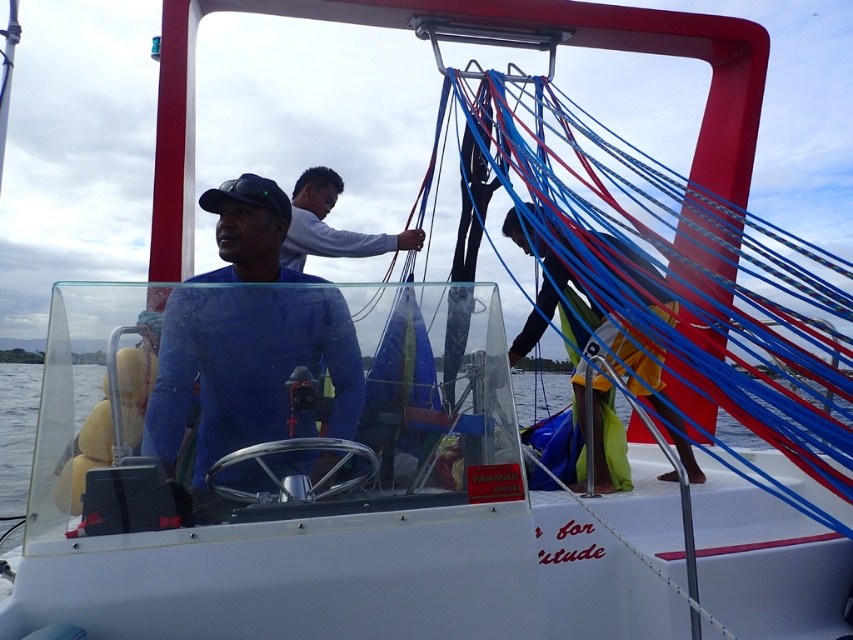
You are on a sailboat and need to secure a rope. You see the blue matte shirt at center and the yellow fabric at right. Which object is closer to the deck? Please answer based on their positions.

The blue matte shirt at center is below the yellow fabric at right, so the blue matte shirt at center is closer to the deck.

You are a sailor on the boat and need to secure the ropes. You see the transparent water at steering wheel left and the white matte shirt at center. Which object is bigger in size?

The transparent water at steering wheel left has a larger size compared to the white matte shirt at center.